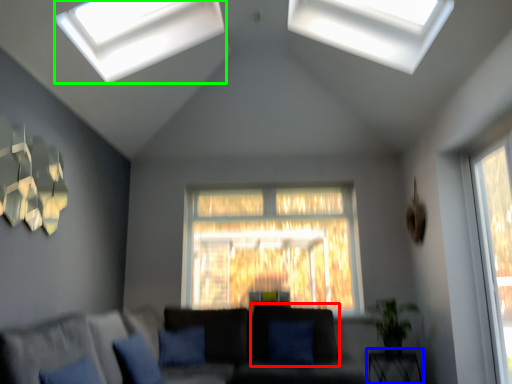
Question: Considering the real-world distances, which object is closest to sit (highlighted by a red box)? table (highlighted by a blue box) or window (highlighted by a green box).

Choices:
 (A) table
 (B) window

Answer: (A)